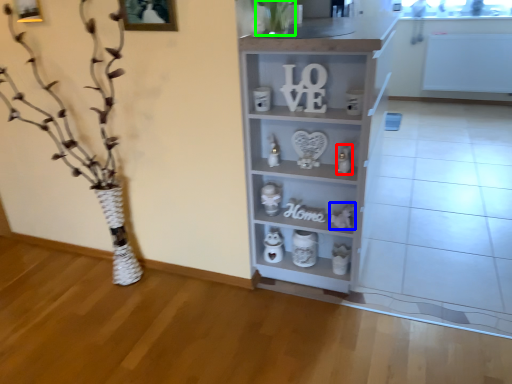
Question: Estimate the real-world distances between objects in this image. Which object is farther from toy (highlighted by a red box), toy (highlighted by a blue box) or plant (highlighted by a green box)?

Choices:
 (A) toy
 (B) plant

Answer: (B)